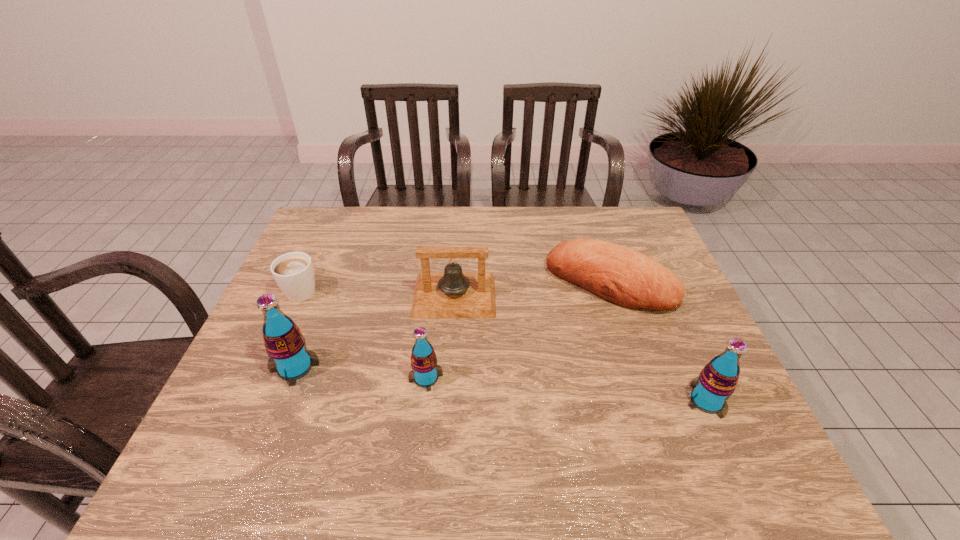
Where is `vacant region between the leftmost soda and the bread`? The width and height of the screenshot is (960, 540). vacant region between the leftmost soda and the bread is located at coordinates (452, 325).

You are a GUI agent. You are given a task and a screenshot of the screen. Output one action in this format:
    pyautogui.click(x=<x>, y=<y>)
    Task: Click on the free space between the cappuccino and the rightmost soda
    Image resolution: width=960 pixels, height=540 pixels.
    Given the screenshot: What is the action you would take?
    pyautogui.click(x=505, y=345)

Where is `free space between the leftmost soda and the bread`? free space between the leftmost soda and the bread is located at coordinates (452, 325).

Find the location of a particular element. The image size is (960, 540). free area in between the leftmost soda and the rightmost soda is located at coordinates (x=501, y=384).

The image size is (960, 540). I want to click on the fifth closest object relative to the leftmost soda, so [x=717, y=381].

Where is `the second closest object to the leftmost soda`? Image resolution: width=960 pixels, height=540 pixels. the second closest object to the leftmost soda is located at coordinates (425, 372).

You are a GUI agent. You are given a task and a screenshot of the screen. Output one action in this format:
    pyautogui.click(x=<x>, y=<y>)
    Task: Click on the soda that is the third closest to the bell
    Image resolution: width=960 pixels, height=540 pixels.
    Given the screenshot: What is the action you would take?
    pyautogui.click(x=717, y=381)

Locate which soda ranks second in proximity to the bread. Please provide its 2D coordinates. Your answer should be formatted as a tuple, i.e. [(x, y)], where the tuple contains the x and y coordinates of a point satisfying the conditions above.

[(425, 372)]

The height and width of the screenshot is (540, 960). Find the location of `blank area in the image that satisfies the following two spatial constraints: 1. on the back side of the leftmost soda; 2. on the left side of the bread`. blank area in the image that satisfies the following two spatial constraints: 1. on the back side of the leftmost soda; 2. on the left side of the bread is located at coordinates (327, 283).

Where is `free location that satisfies the following two spatial constraints: 1. with the handle on the side of the cappuccino; 2. on the left side of the bread`? This screenshot has width=960, height=540. free location that satisfies the following two spatial constraints: 1. with the handle on the side of the cappuccino; 2. on the left side of the bread is located at coordinates (305, 283).